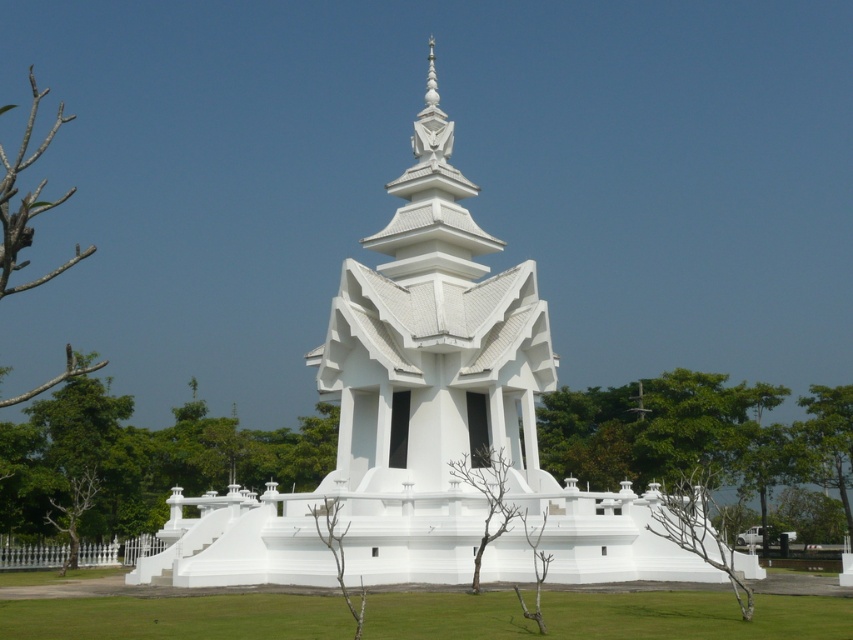
Who is more forward, (231, 614) or (680, 372)?

Point (231, 614)

The height and width of the screenshot is (640, 853). Find the location of `green grass at lower center`. green grass at lower center is located at coordinates (178, 616).

Between green leafy tree at lower left and green leafy tree at right, which one appears on the right side from the viewer's perspective?

Positioned to the right is green leafy tree at right.

Is point (132, 497) behind point (606, 458)?

No, (132, 497) is closer to viewer.

Identify the location of green leafy tree at lower left. (138, 460).

Who is more distant from viewer, (689, 388) or (80, 372)?

Positioned behind is point (689, 388).

Between green leafy tree at right and bare branches at left, which one appears on the left side from the viewer's perspective?

Positioned to the left is bare branches at left.

Where is `green leafy tree at right`? green leafy tree at right is located at coordinates (698, 438).